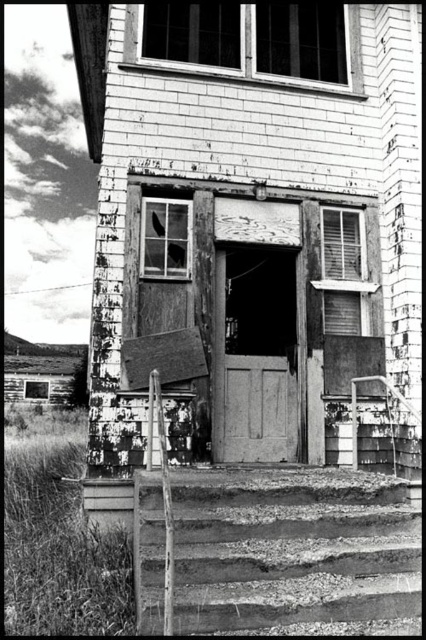
This screenshot has height=640, width=426. Describe the element at coordinates (294, 552) in the screenshot. I see `rusty metal stairs at center` at that location.

Which is more to the left, rusty metal stairs at center or smooth wooden door at center?

smooth wooden door at center

Is point (380, 550) in front of point (247, 440)?

That is True.

The height and width of the screenshot is (640, 426). Identify the location of rusty metal stairs at center. (294, 552).